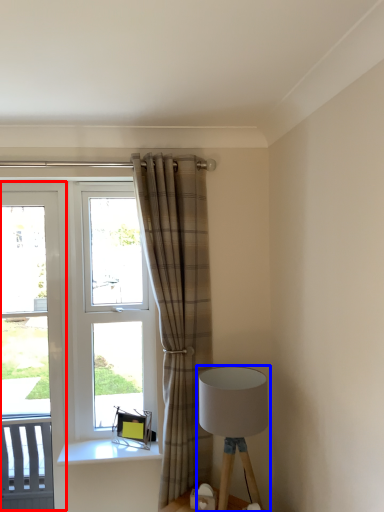
Question: Which point is further to the camera, screen door (highlighted by a red box) or lamp (highlighted by a blue box)?

Choices:
 (A) screen door
 (B) lamp

Answer: (A)